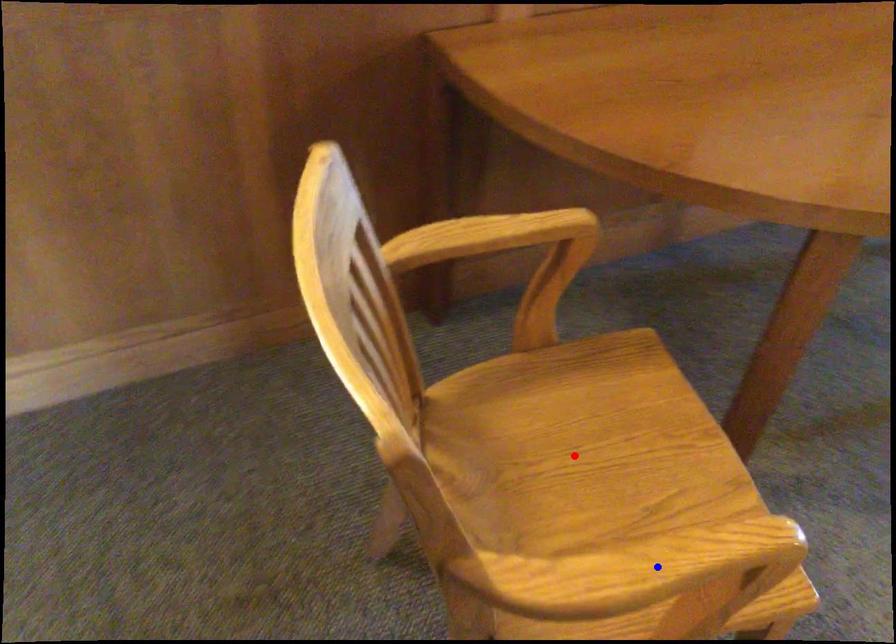
Question: Which of the two points in the image is closer to the camera?

Choices:
 (A) Blue point is closer.
 (B) Red point is closer.

Answer: (A)